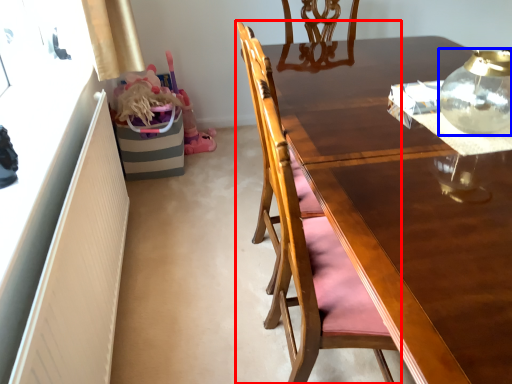
Question: Among these objects, which one is farthest to the camera, chair (highlighted by a red box) or tea pot (highlighted by a blue box)?

Choices:
 (A) chair
 (B) tea pot

Answer: (A)